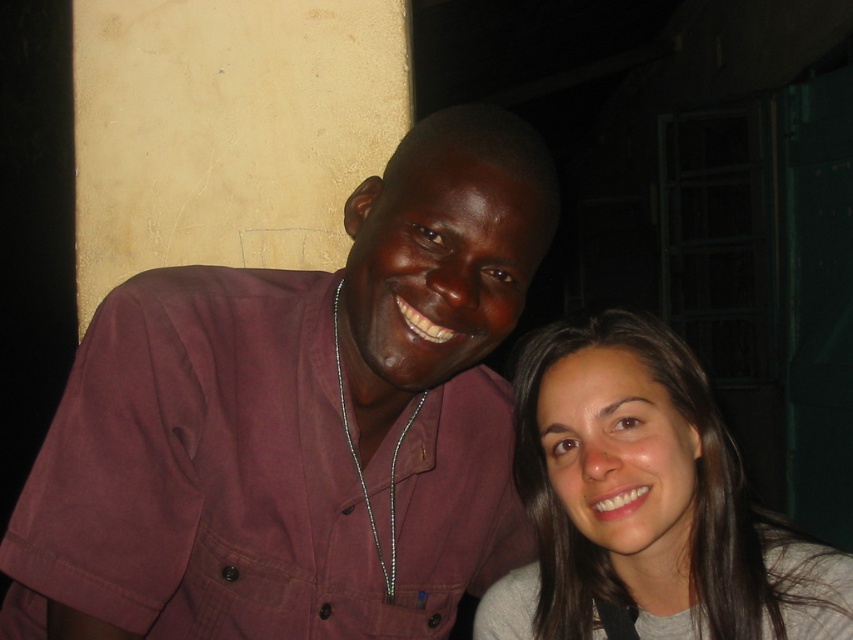
You are taking a photo of two people. The man in the maroon shirt at center is standing near the doorway. Can you tell me where the point at coordinates (299,422) is located relative to the maroon shirt at center?

The point at coordinates (299,422) corresponds to the maroon shirt at center, so it is exactly at the center of the maroon shirt.

You are a photographer setting up a portrait for two people. The scene requires the maroon shirt at center and the smooth gray sweater at right to be visible in the frame. Based on their heights, which clothing item should you adjust the camera angle to focus on first?

The maroon shirt at center is taller than the smooth gray sweater at right, so you should focus on the maroon shirt at center first to ensure it is properly framed before adjusting for the shorter sweater.

You are standing in front of a photo of two people. You notice the maroon shirt at center and the smooth gray sweater at right. Which clothing item is positioned closer to the left side of the photo?

The maroon shirt at center is positioned closer to the left side of the photo than the smooth gray sweater at right.